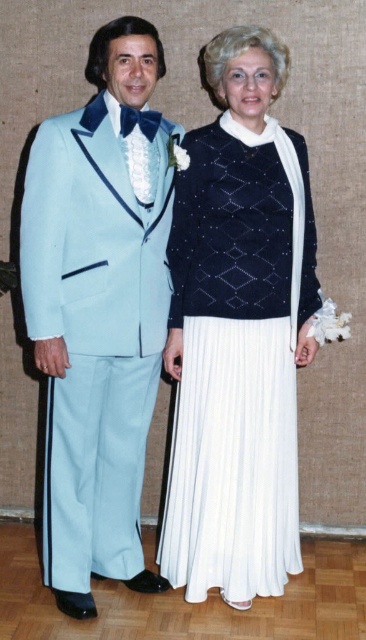
Question: Which object appears farthest from the camera in this image?

Choices:
 (A) white pleated skirt at center
 (B) light blue satin tuxedo at left

Answer: (A)

Question: Is light blue satin tuxedo at left to the left of white pleated skirt at center from the viewer's perspective?

Choices:
 (A) yes
 (B) no

Answer: (A)

Question: Is light blue satin tuxedo at left above white pleated skirt at center?

Choices:
 (A) yes
 (B) no

Answer: (A)

Question: Is light blue satin tuxedo at left smaller than white pleated skirt at center?

Choices:
 (A) yes
 (B) no

Answer: (B)

Question: Which point is farther from the camera taking this photo?

Choices:
 (A) (83, 595)
 (B) (277, 216)

Answer: (A)